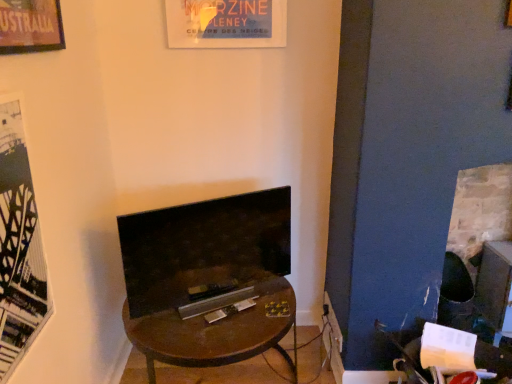
Find the location of a particular element. vacant area in front of metallic silver magazine at center is located at coordinates (236, 331).